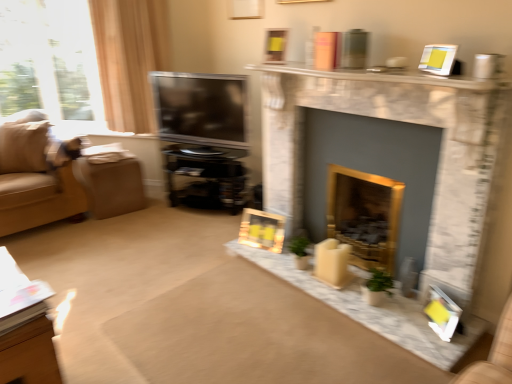
The image size is (512, 384). In order to click on unoccupied area in front of brown fabric footrest at left in this screenshot , I will do `click(102, 222)`.